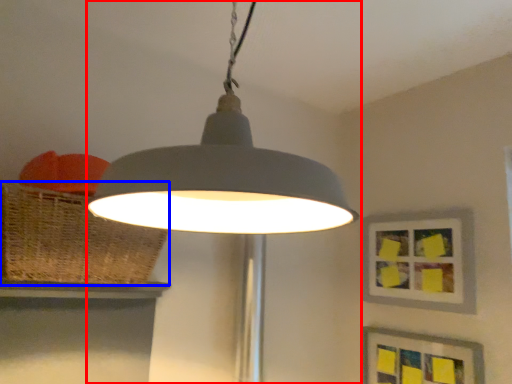
Question: Among these objects, which one is farthest to the camera, lamp (highlighted by a red box) or basket (highlighted by a blue box)?

Choices:
 (A) lamp
 (B) basket

Answer: (B)